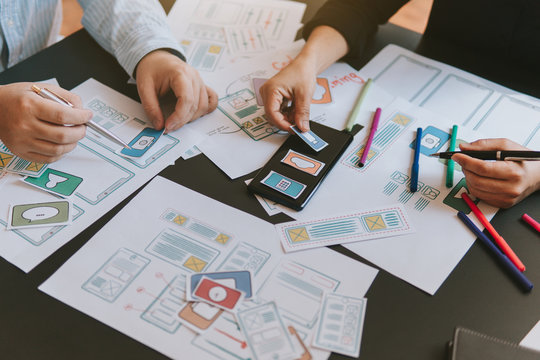
Image resolution: width=540 pixels, height=360 pixels. In order to click on pens in this screenshot , I will do `click(356, 109)`, `click(375, 126)`, `click(414, 144)`, `click(450, 140)`, `click(482, 156)`, `click(489, 245)`, `click(498, 241)`, `click(529, 223)`.